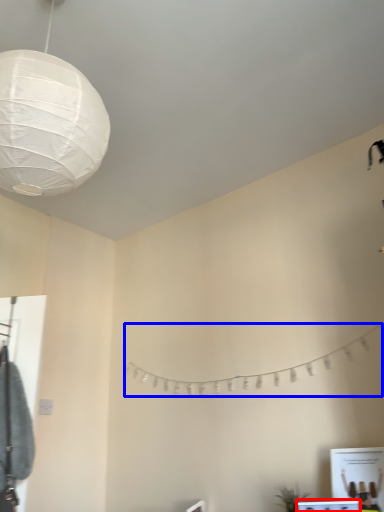
Question: Which of the following is the closest to the observer, vanity (highlighted by a red box) or clothesline (highlighted by a blue box)?

Choices:
 (A) vanity
 (B) clothesline

Answer: (A)